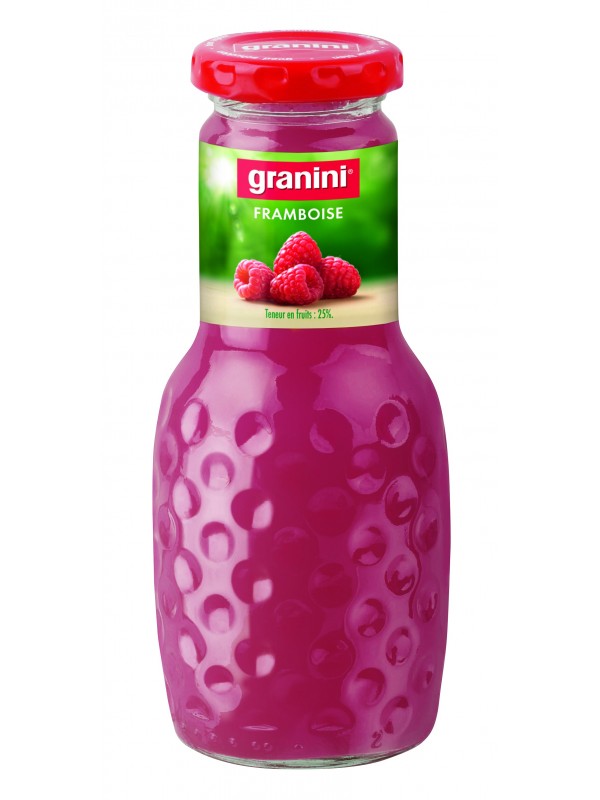
At what (x,y) coordinates should I click in order to perform the action: click on light. Please return your answer as a coordinate pair (x, y). This screenshot has height=800, width=600. Looking at the image, I should click on (223, 173).